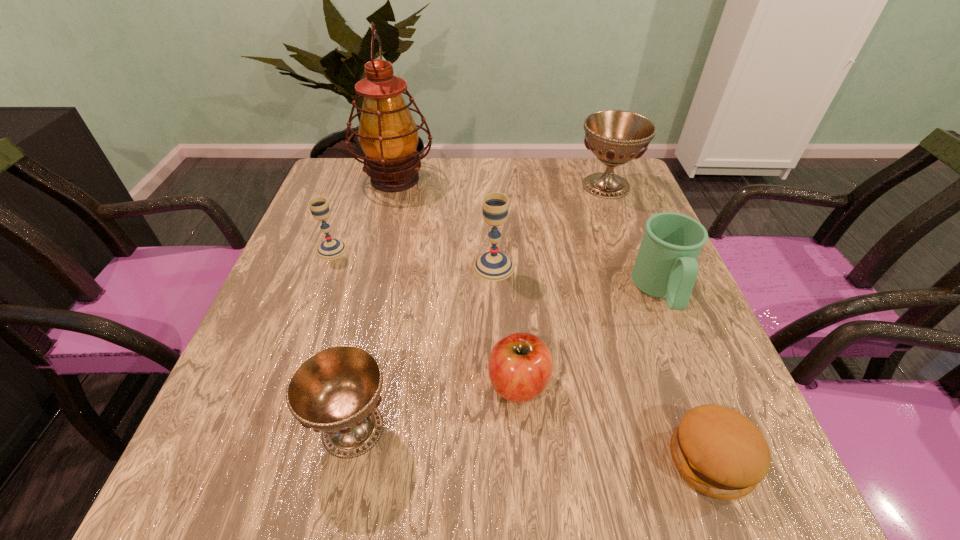
This screenshot has width=960, height=540. In order to click on vacant space that is in between the second shortest object and the mug in this screenshot , I will do `click(589, 338)`.

I want to click on free space between the tallest object and the shortest object, so coord(553,320).

At what (x,y) coordinates should I click in order to perform the action: click on vacant space that's between the nearer red chalice and the seventh tallest object. Please return your answer as a coordinate pair (x, y). This screenshot has width=960, height=540. Looking at the image, I should click on (436, 406).

Locate an element on the screen. The width and height of the screenshot is (960, 540). vacant space in between the seventh tallest object and the oil lamp is located at coordinates (457, 281).

Locate an element on the screen. Image resolution: width=960 pixels, height=540 pixels. empty location between the right gray chalice and the farther red chalice is located at coordinates (550, 226).

Locate an element on the screen. The height and width of the screenshot is (540, 960). object that can be found as the second closest to the bigger red chalice is located at coordinates (492, 266).

Where is `object that is the second closest one to the right red chalice`? object that is the second closest one to the right red chalice is located at coordinates (492, 266).

At what (x,y) coordinates should I click in order to perform the action: click on chalice that is the third closest to the apple. Please return your answer as a coordinate pair (x, y). This screenshot has width=960, height=540. Looking at the image, I should click on (330, 249).

Find the location of a particular element. Image resolution: width=960 pixels, height=540 pixels. the second closest chalice relative to the mug is located at coordinates (492, 266).